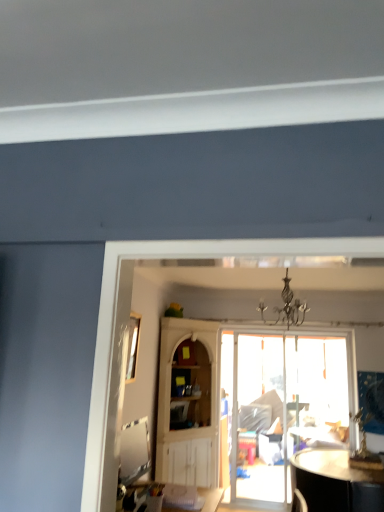
The image size is (384, 512). I want to click on black wrought iron chandelier at center, so click(x=286, y=307).

The width and height of the screenshot is (384, 512). What do you see at coordinates (281, 408) in the screenshot?
I see `translucent glass door at center` at bounding box center [281, 408].

What do you see at coordinates (189, 404) in the screenshot?
I see `white wood cabinet at center` at bounding box center [189, 404].

In order to face white wood cabinet at center, should I rotate leftwards or rightwards?

Turn left by 1.190 degrees to look at white wood cabinet at center.

Where is `black wrought iron chandelier at center`? black wrought iron chandelier at center is located at coordinates (286, 307).

Is white wood cabinet at center facing away from clear glass window at upper left?

white wood cabinet at center does not have its back to clear glass window at upper left.

Between white wood cabinet at center and clear glass window at upper left, which one has smaller size?

Smaller between the two is clear glass window at upper left.

From a real-world perspective, is white wood cabinet at center positioned above or below clear glass window at upper left?

In terms of real-world spatial position, white wood cabinet at center is below clear glass window at upper left.

Is clear glass window at upper left outside of translucent glass door at center?

Yes, clear glass window at upper left is outside of translucent glass door at center.

Is clear glass window at upper left with translucent glass door at center?

No, clear glass window at upper left is not with translucent glass door at center.

Is clear glass window at upper left taller or shorter than translucent glass door at center?

Clearly, clear glass window at upper left is shorter compared to translucent glass door at center.

Which of these two, clear glass window at upper left or translucent glass door at center, is thinner?

Thinner between the two is translucent glass door at center.

From a real-world perspective, is translucent glass door at center below black wrought iron chandelier at center?

Yes.

In the scene shown: From the image's perspective, is translucent glass door at center above black wrought iron chandelier at center?

Actually, translucent glass door at center appears below black wrought iron chandelier at center in the image.

Can you confirm if translucent glass door at center is positioned to the left of black wrought iron chandelier at center?

No.

What's the angular difference between translucent glass door at center and black wrought iron chandelier at center's facing directions?

The angle between the facing direction of translucent glass door at center and the facing direction of black wrought iron chandelier at center is 2.34 degrees.

From a real-world perspective, is clear glass window at upper left located higher than white wood cabinet at center?

Yes.

Which is in front, point (133, 358) or point (186, 475)?

The point (133, 358) is in front.

Is clear glass window at upper left oriented towards white wood cabinet at center?

A: No.

Considering their positions, is white wood cabinet at center located in front of or behind translucent glass door at center?

white wood cabinet at center is in front of translucent glass door at center.

You are a GUI agent. You are given a task and a screenshot of the screen. Output one action in this format:
    pyautogui.click(x=<x>, y=<y>)
    Task: Click on the door behind the white wood cabinet at center
    This screenshot has width=384, height=512.
    Given the screenshot: What is the action you would take?
    pyautogui.click(x=281, y=408)

Is translucent glass door at center with clear glass window at upper left?

No.

Considering the positions of points (237, 472) and (128, 355), is point (237, 472) farther from camera compared to point (128, 355)?

Yes, point (237, 472) is farther from viewer.

From the image's perspective, is translucent glass door at center on clear glass window at upper left?

No, from the image's perspective, translucent glass door at center is not over clear glass window at upper left.

From a real-world perspective, is translucent glass door at center physically above clear glass window at upper left?

No, from a real-world perspective, translucent glass door at center is not over clear glass window at upper left

From a real-world perspective, between black wrought iron chandelier at center and white wood cabinet at center, who is vertically higher?

black wrought iron chandelier at center, from a real-world perspective.

Is black wrought iron chandelier at center taller or shorter than white wood cabinet at center?

Considering their sizes, black wrought iron chandelier at center has less height than white wood cabinet at center.

Measure the distance from black wrought iron chandelier at center to white wood cabinet at center.

A: They are 5.94 feet apart.

Is black wrought iron chandelier at center behind white wood cabinet at center?

No, it is not.

What are the coordinates of `window that is in front of the white wood cabinet at center` in the screenshot? It's located at (133, 346).

Identify the location of window above the translucent glass door at center (from a real-world perspective). (133, 346).

Which object lies further to the anchor point clear glass window at upper left, translucent glass door at center or black wrought iron chandelier at center?

translucent glass door at center is further to clear glass window at upper left.

Which object lies nearer to the anchor point translucent glass door at center, white wood cabinet at center or black wrought iron chandelier at center?

white wood cabinet at center.

From the image, which object appears to be nearer to black wrought iron chandelier at center, translucent glass door at center or clear glass window at upper left?

The object closer to black wrought iron chandelier at center is clear glass window at upper left.

From the image, which object appears to be farther from white wood cabinet at center, black wrought iron chandelier at center or translucent glass door at center?

Among the two, black wrought iron chandelier at center is located further to white wood cabinet at center.

When comparing their distances from white wood cabinet at center, does clear glass window at upper left or black wrought iron chandelier at center seem further?

black wrought iron chandelier at center.

From the image, which object appears to be farther from black wrought iron chandelier at center, translucent glass door at center or white wood cabinet at center?

Based on the image, translucent glass door at center appears to be further to black wrought iron chandelier at center.

Considering their positions, is white wood cabinet at center positioned further to clear glass window at upper left than black wrought iron chandelier at center?

The object further to clear glass window at upper left is black wrought iron chandelier at center.

Which object lies further to the anchor point black wrought iron chandelier at center, white wood cabinet at center or translucent glass door at center?

translucent glass door at center is positioned further to the anchor black wrought iron chandelier at center.

Locate an element on the screen. cabinetry positioned between black wrought iron chandelier at center and translucent glass door at center from near to far is located at coordinates (189, 404).

Find the location of a particular element. Image resolution: width=384 pixels, height=512 pixels. cabinetry between clear glass window at upper left and translucent glass door at center in the horizontal direction is located at coordinates (189, 404).

Identify the location of window located between black wrought iron chandelier at center and translucent glass door at center in the depth direction. (133, 346).

What are the coordinates of `window between black wrought iron chandelier at center and white wood cabinet at center from top to bottom` in the screenshot? It's located at (133, 346).